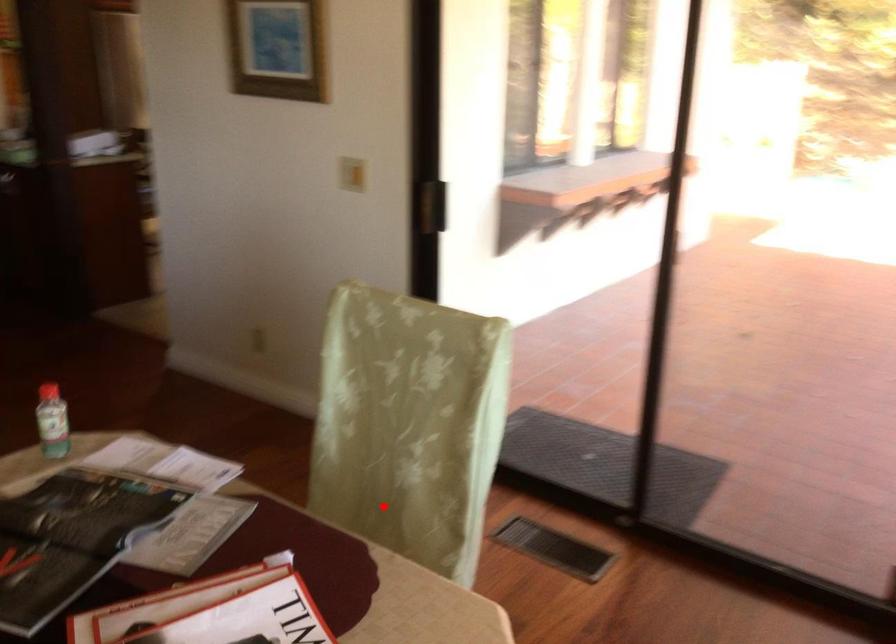
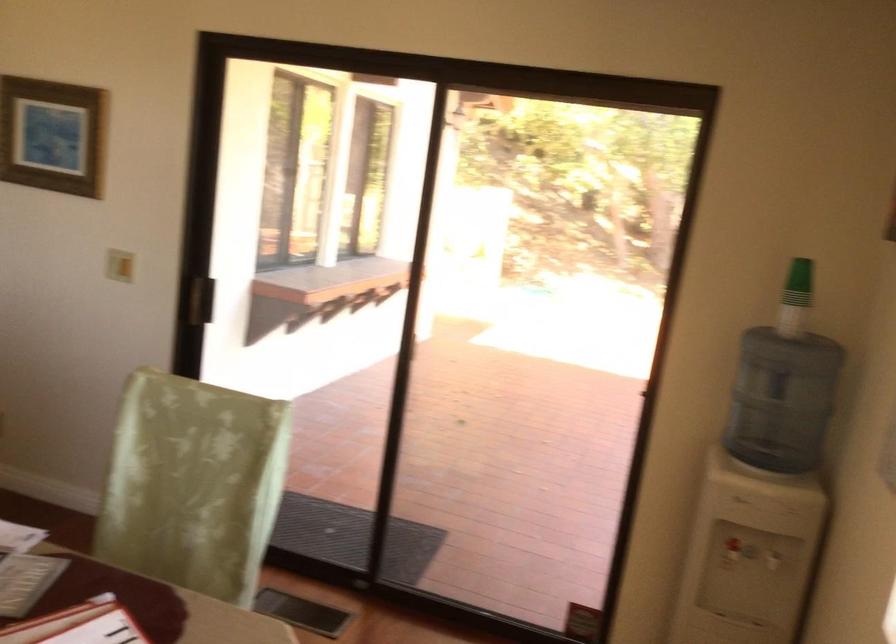
In the second image, find the point that corresponds to the highlighted location in the first image.

(168, 565)